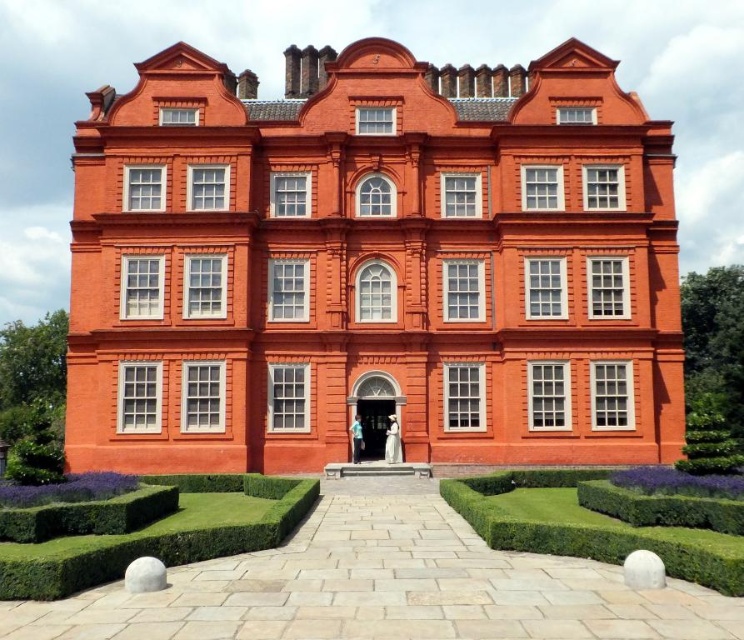
You are standing at the entrance of the red brick building and want to walk to the green textured hedge at center. Which direction should you turn to avoid the green textured hedge at lower left?

Since the green textured hedge at lower left is to the left of the green textured hedge at center, you should turn to your right to avoid it and head towards the green textured hedge at center.

You are standing at the entrance of the red brick building and looking towards the garden. There is a point labeled as point (89, 515). What object does this point correspond to?

The point (89, 515) corresponds to the green textured hedge at lower left.

You are standing at the entrance of the red brick building and want to reach the point marked at coordinates point (535, 541). The path you need to take is 42.69 meters long. Is this path long enough to allow you to comfortably walk to the point without rushing?

The path to point (535, 541) is 42.69 meters long, which should be sufficient for a comfortable walk without rushing.